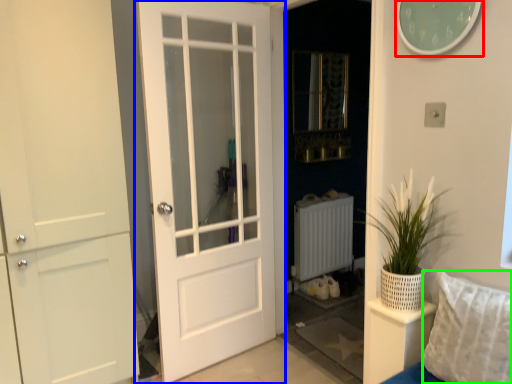
Question: Estimate the real-world distances between objects in this image. Which object is farther from clock (highlighted by a red box), door (highlighted by a blue box) or pillow (highlighted by a green box)?

Choices:
 (A) door
 (B) pillow

Answer: (A)